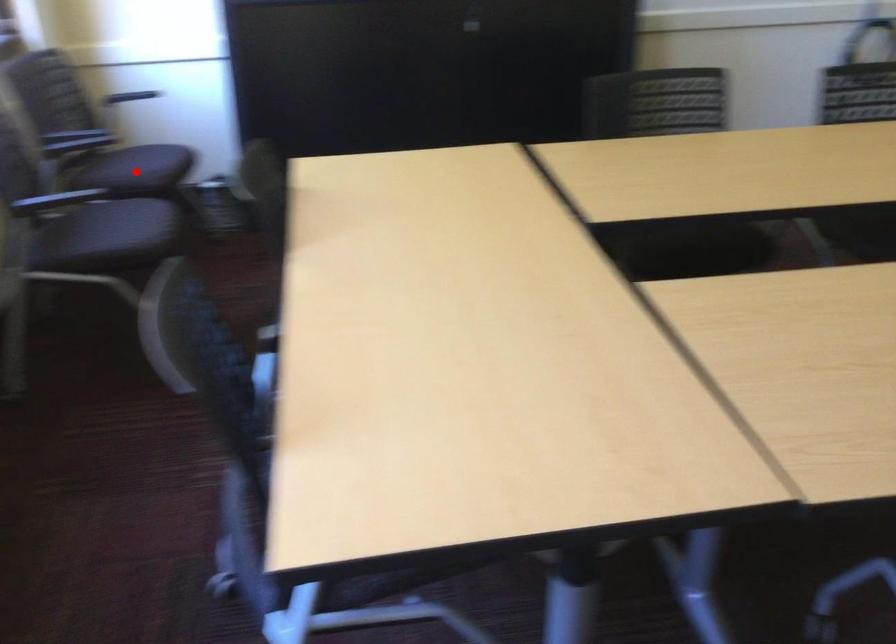
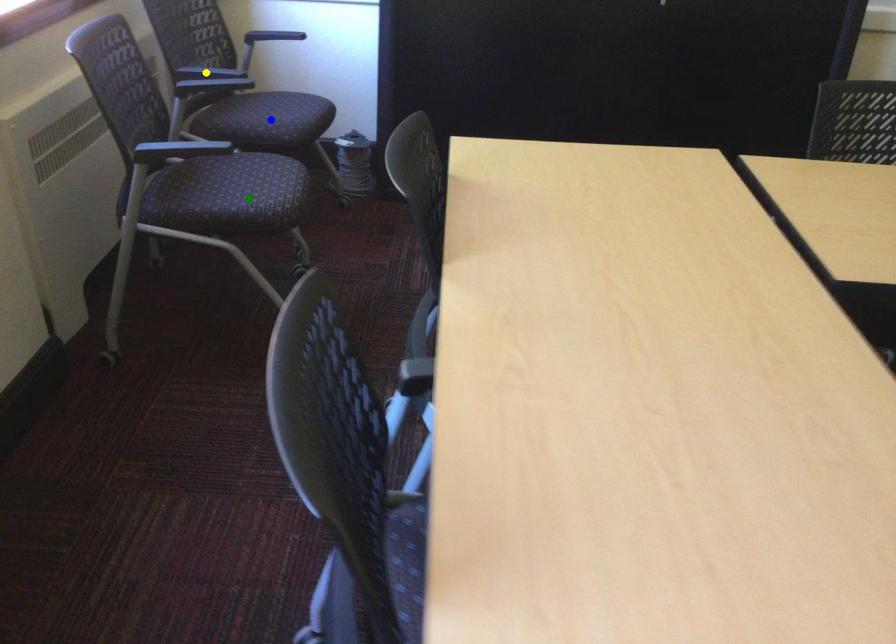
Question: I am providing you with two images of the same scene from different viewpoints. A red point is marked on the first image. You are given multiple points on the second image. Can you choose the point in image 2 that corresponds to the point in image 1?

Choices:
 (A) green point
 (B) yellow point
 (C) blue point

Answer: (C)